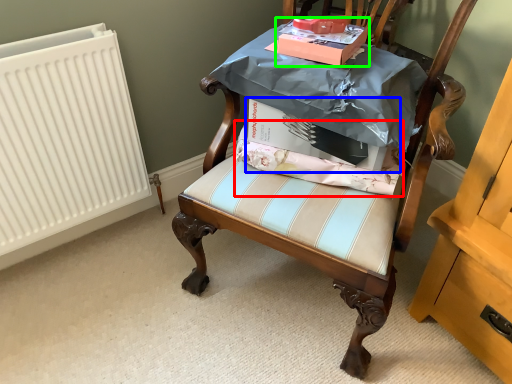
Question: Based on their relative distances, which object is farther from fabric (highlighted by a red box)? Choose from cardboard box (highlighted by a blue box) and cardboard box (highlighted by a green box).

Choices:
 (A) cardboard box
 (B) cardboard box

Answer: (B)